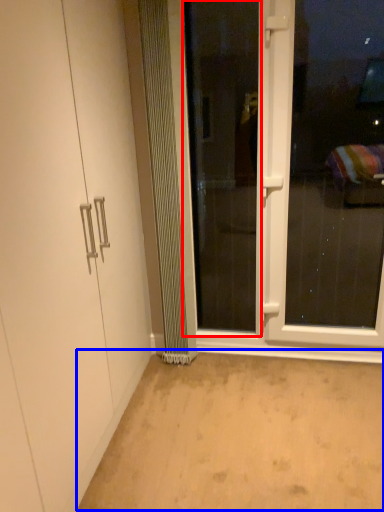
Question: Which of the following is the closest to the observer, screen door (highlighted by a red box) or plain (highlighted by a blue box)?

Choices:
 (A) screen door
 (B) plain

Answer: (B)